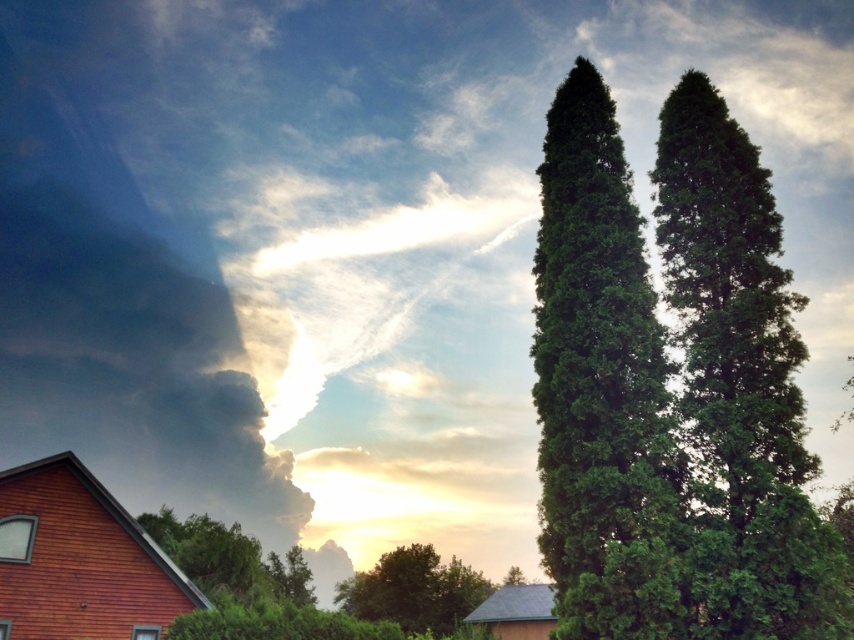
Does green textured cypress at right appear on the right side of green leafy cypress at right?

No, green textured cypress at right is not to the right of green leafy cypress at right.

Which is in front, point (559, 163) or point (741, 458)?

Positioned in front is point (741, 458).

The height and width of the screenshot is (640, 854). Describe the element at coordinates (600, 387) in the screenshot. I see `green textured cypress at right` at that location.

Locate an element on the screen. Image resolution: width=854 pixels, height=640 pixels. green textured cypress at right is located at coordinates (600, 387).

Who is more forward, [190,552] or [454,560]?

Point [190,552] is in front.

Between green leafy tree at lower left and green leafy tree at center, which one is positioned lower?

green leafy tree at center

Is point (268, 595) behind point (427, 545)?

No, (268, 595) is in front of (427, 545).

Where is `green leafy tree at lower left`? green leafy tree at lower left is located at coordinates (227, 557).

Based on the photo, does green leafy cypress at right have a greater height compared to green leafy tree at lower left?

Correct, green leafy cypress at right is much taller as green leafy tree at lower left.

Is point (709, 337) less distant than point (182, 554)?

Yes, it is.

Locate an element on the screen. This screenshot has width=854, height=640. green leafy cypress at right is located at coordinates (736, 376).